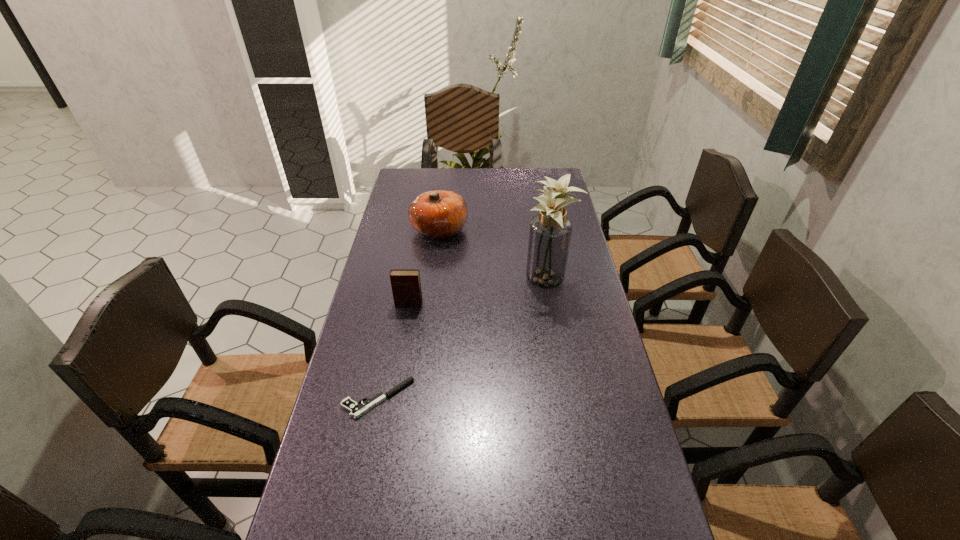
Where is `pumpkin situated at the left edge`? This screenshot has width=960, height=540. pumpkin situated at the left edge is located at coordinates (437, 214).

At what (x,y) coordinates should I click in order to perform the action: click on diary located in the left edge section of the desktop. Please return your answer as a coordinate pair (x, y). Looking at the image, I should click on (406, 287).

Where is `pistol present at the left edge`? pistol present at the left edge is located at coordinates coord(356,409).

Where is `object at the right edge`? The image size is (960, 540). object at the right edge is located at coordinates (550, 232).

The image size is (960, 540). Find the location of `free space at the far edge of the desktop`. free space at the far edge of the desktop is located at coordinates (441, 186).

Find the location of `vacant space at the left edge of the desktop`. vacant space at the left edge of the desktop is located at coordinates (396, 341).

Identify the location of vacant space at the right edge of the desktop. (565, 360).

Where is `vacant space at the far left corner of the desktop`? The height and width of the screenshot is (540, 960). vacant space at the far left corner of the desktop is located at coordinates (430, 188).

Locate an element on the screen. vacant region at the far right corner of the desktop is located at coordinates [x=542, y=186].

This screenshot has width=960, height=540. In order to click on empty space between the second tallest object and the flower arrangement in this screenshot , I will do `click(492, 255)`.